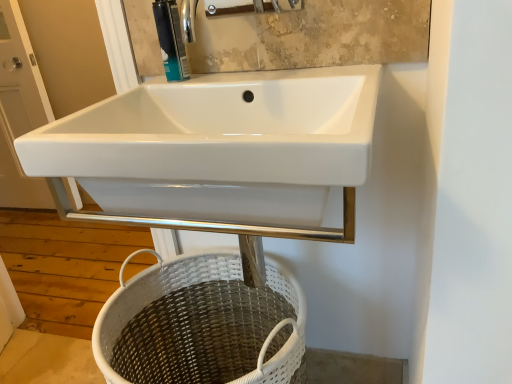
You are a GUI agent. You are given a task and a screenshot of the screen. Output one action in this format:
    pyautogui.click(x=<x>, y=<y>)
    Task: Click on the vacant area that is situated to the right of matte plastic soap dispenser at upper center
    The height and width of the screenshot is (384, 512).
    Given the screenshot: What is the action you would take?
    pyautogui.click(x=242, y=81)